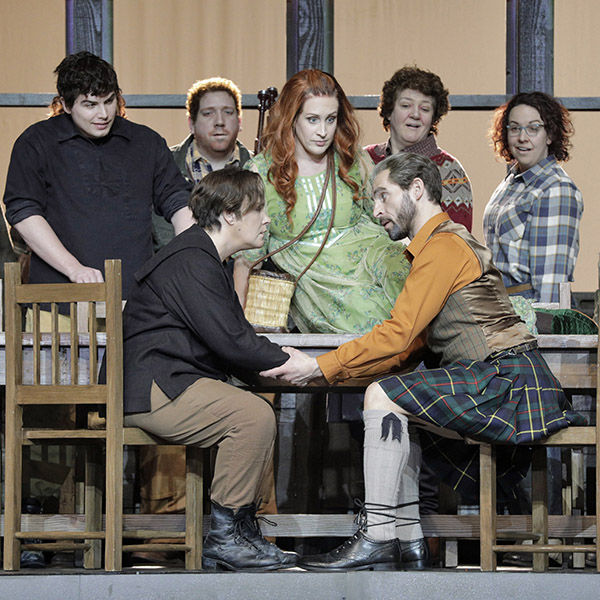
Identify the location of chair. This screenshot has height=600, width=600. (95, 391).